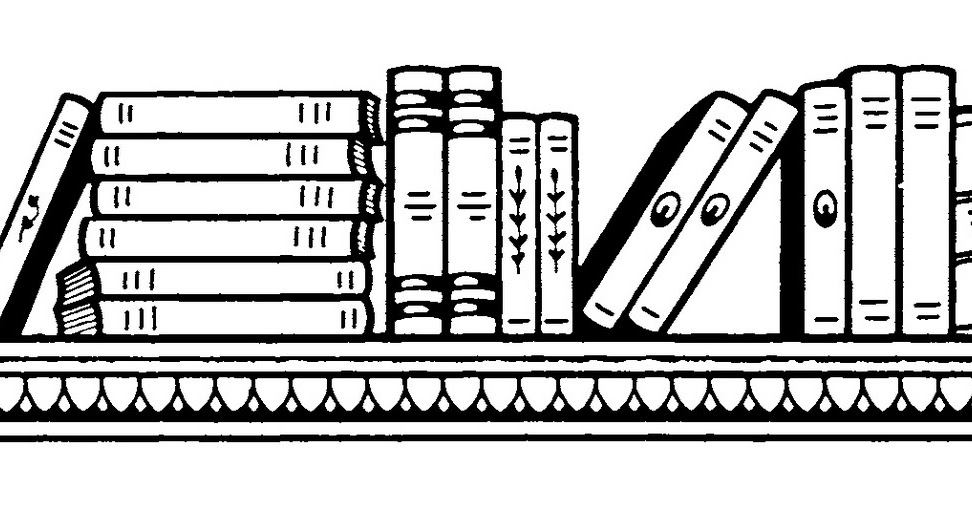
Locate an element on the screen. The image size is (972, 510). books laying flat is located at coordinates (253, 321), (255, 273), (253, 245), (262, 200), (245, 161), (260, 123).